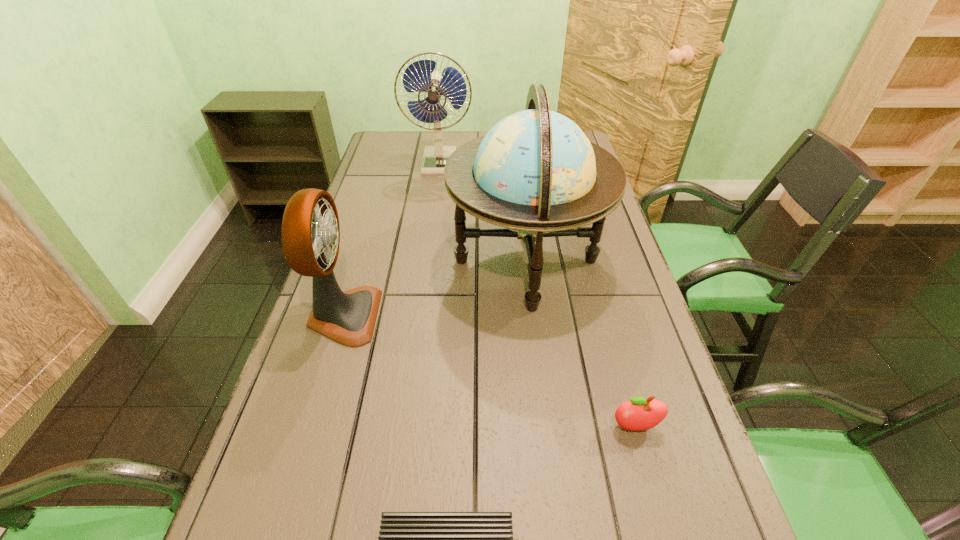
Find the location of a particular element. vacant area situated 0.080m on the front-facing side of the third shortest object is located at coordinates coord(412,316).

In order to click on vacant space located 0.220m on the back of the second nearest object in this screenshot , I will do `click(608, 330)`.

Where is `object situated at the far edge`? Image resolution: width=960 pixels, height=540 pixels. object situated at the far edge is located at coordinates (419, 77).

This screenshot has height=540, width=960. In order to click on globe that is at the right edge in this screenshot , I will do `click(535, 173)`.

Where is `apple at the right edge`? apple at the right edge is located at coordinates tap(638, 414).

Find the location of a particular element. The image size is (960, 540). object that is at the far left corner is located at coordinates (419, 77).

This screenshot has width=960, height=540. I want to click on free space at the far edge of the desktop, so click(x=431, y=141).

At what (x,y) coordinates should I click in order to perform the action: click on free spot at the left edge of the desktop. Please return your answer as a coordinate pair (x, y). The width and height of the screenshot is (960, 540). Looking at the image, I should click on (351, 256).

Where is `free spot at the right edge of the desktop`? The image size is (960, 540). free spot at the right edge of the desktop is located at coordinates (590, 338).

The image size is (960, 540). Find the location of `free space between the fourth tallest object and the third shortest object`. free space between the fourth tallest object and the third shortest object is located at coordinates point(490,372).